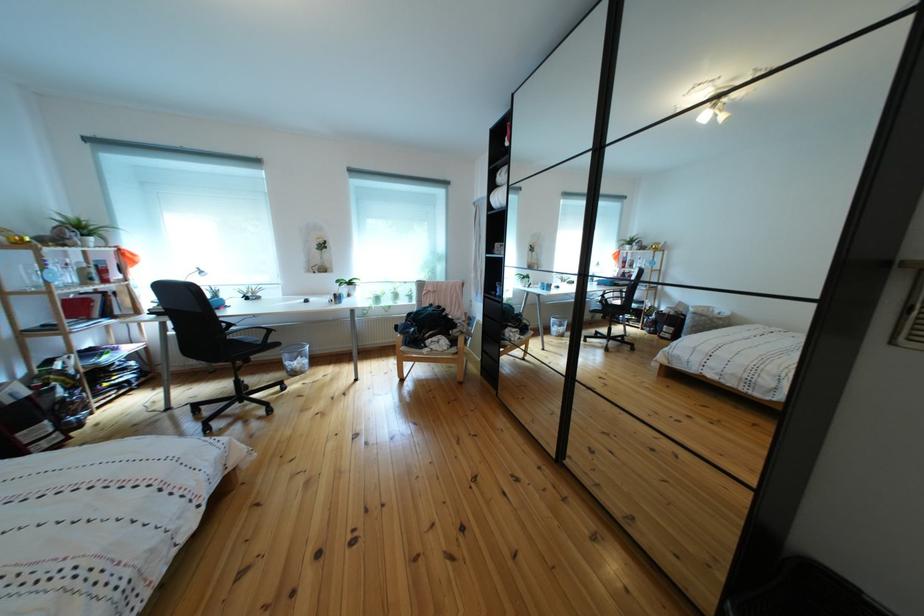
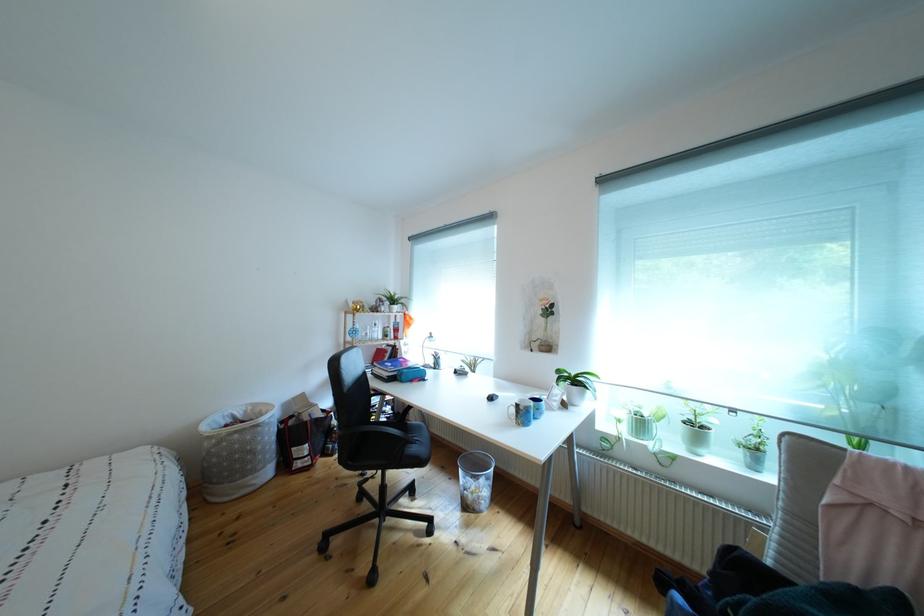
The point at (x=78, y=292) is marked in the first image. Where is the corresponding point in the second image?

(383, 345)